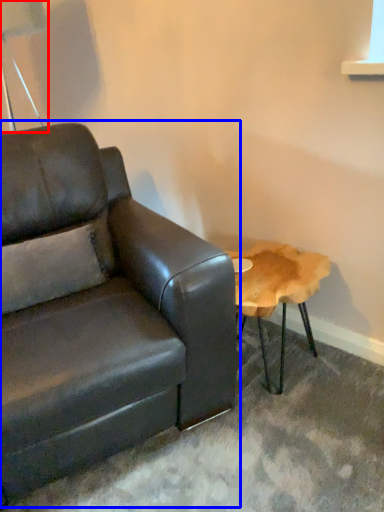
Question: Which object is further to the camera taking this photo, table lamp (highlighted by a red box) or studio couch (highlighted by a blue box)?

Choices:
 (A) table lamp
 (B) studio couch

Answer: (A)